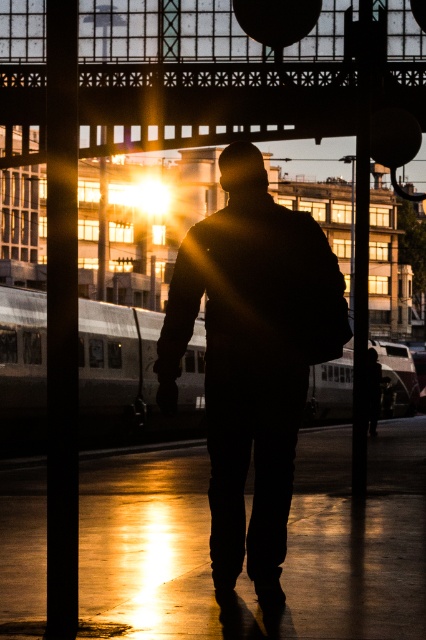
You are a photographer trying to capture the silhouette of the person wearing the black matte jacket at center and the silver metallic train at center. Since the sun is behind them, you want to position yourself so that the person is between you and the sun. Based on their positions, which object should you place closer to the sun to achieve the silhouette effect?

The black matte jacket at center is to the left of the silver metallic train at center, so to achieve the silhouette effect, you should position yourself so that the black matte jacket at center is closer to the sun. This way, the person wearing it will be backlit, creating the desired silhouette.

You are a photographer trying to capture the silhouette of the person wearing the black matte jacket at center without the silver metallic train at center appearing in the foreground. Can you adjust your position to achieve this?

The black matte jacket at center is in front of the silver metallic train at center, so moving your position to the side might allow you to frame the jacket silhouette without the train in the foreground.

You are a photographer trying to capture the silhouette of the black matte jacket at center against the sunset backdrop. Since the silver metallic train at center is also in the scene, will the train be visible behind the jacket?

The black matte jacket at center is above the silver metallic train at center, so the train will be visible behind the jacket as it is positioned below the jacket in the scene.